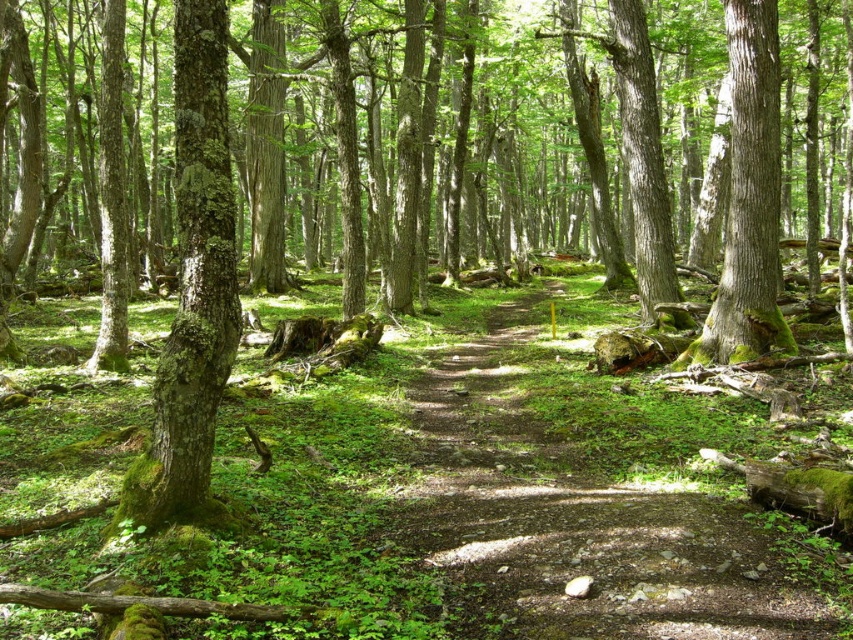
Question: Where is green mossy bark tree at left located in relation to green mossy tree at right in the image?

Choices:
 (A) right
 (B) left

Answer: (B)

Question: Which point is closer to the camera?

Choices:
 (A) green mossy tree at right
 (B) dirt path at center

Answer: (B)

Question: Considering the real-world distances, which object is farthest from the dirt path at center?

Choices:
 (A) green mossy bark tree at left
 (B) green mossy tree at right

Answer: (B)

Question: Can you confirm if dirt path at center is thinner than green mossy bark tree at left?

Choices:
 (A) yes
 (B) no

Answer: (B)

Question: Does dirt path at center have a smaller size compared to green mossy bark tree at left?

Choices:
 (A) no
 (B) yes

Answer: (A)

Question: Which point is farther to the camera?

Choices:
 (A) (701, 616)
 (B) (756, 193)

Answer: (B)